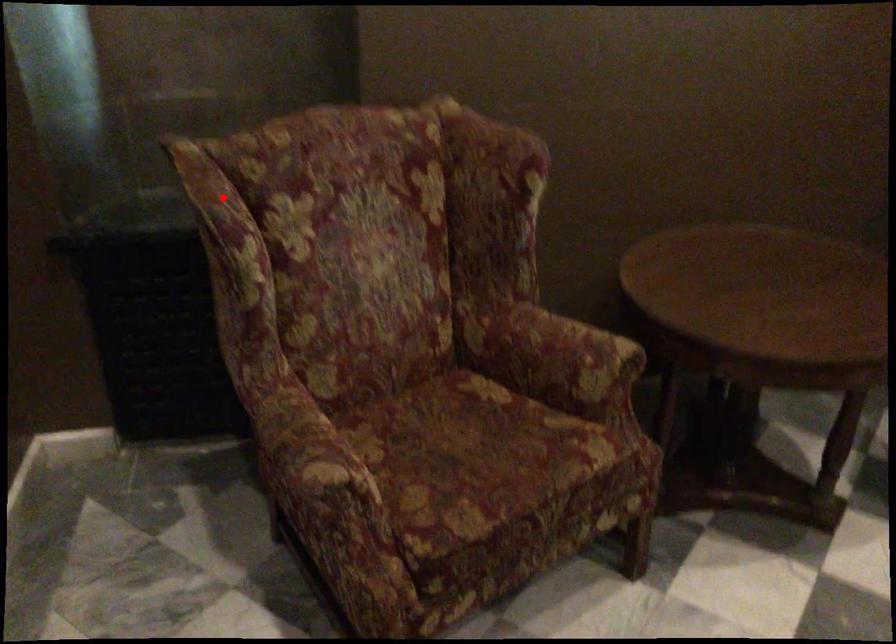
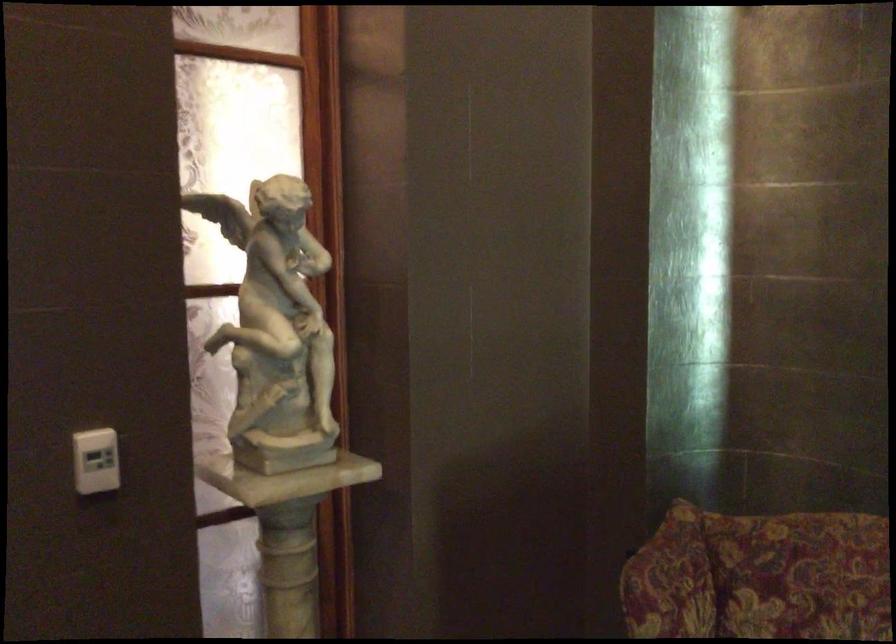
In the second image, find the point that corresponds to the highlighted location in the first image.

(670, 581)